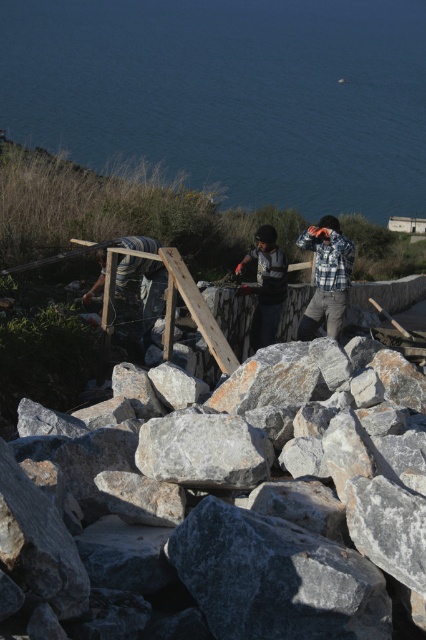
Question: Which of the following is the closest to the observer?

Choices:
 (A) (149, 340)
 (B) (262, 289)
 (C) (324, 300)

Answer: (A)

Question: In this image, where is dark gray fabric shirt at center located relative to striped shirt at center?

Choices:
 (A) above
 (B) below

Answer: (A)

Question: Based on their relative distances, which object is farther from the plaid flannel shirt at center?

Choices:
 (A) striped shirt at center
 (B) dark gray fabric shirt at center
 (C) gray granite rocks at center
 (D) blue water at upper center

Answer: (D)

Question: Does dark gray fabric shirt at center lie behind striped shirt at center?

Choices:
 (A) no
 (B) yes

Answer: (B)

Question: Which object appears farthest from the camera in this image?

Choices:
 (A) striped shirt at center
 (B) gray granite rocks at center

Answer: (A)

Question: Is gray granite rocks at center to the right of blue water at upper center from the viewer's perspective?

Choices:
 (A) yes
 (B) no

Answer: (B)